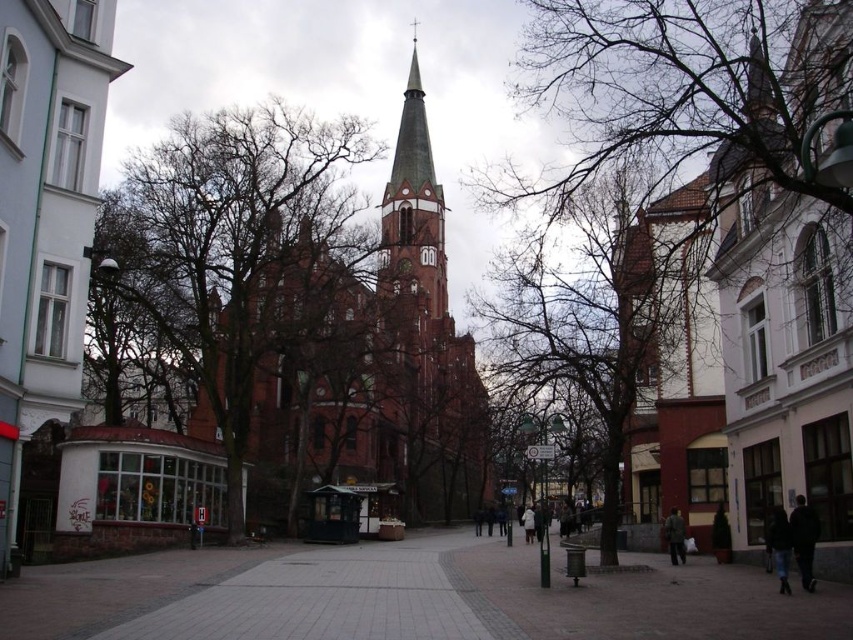
Measure the distance between bare branches at center and camera.

39.82 meters

Does point (834, 465) lie in front of point (80, 284)?

That is True.

Is point (643, 19) more distant than point (28, 92)?

Yes, it is behind point (28, 92).

Locate an element on the screen. Image resolution: width=853 pixels, height=640 pixels. bare branches at center is located at coordinates tap(734, 202).

Which is more to the right, bare branches at left or white wool coat at center?

From the viewer's perspective, white wool coat at center appears more on the right side.

Does bare branches at left have a smaller size compared to white wool coat at center?

No, bare branches at left is not smaller than white wool coat at center.

What do you see at coordinates (239, 248) in the screenshot? The width and height of the screenshot is (853, 640). I see `bare branches at left` at bounding box center [239, 248].

At what (x,y) coordinates should I click in order to perform the action: click on bare branches at left. Please return your answer as a coordinate pair (x, y). Looking at the image, I should click on (239, 248).

Can you confirm if matte brick church at center is shorter than dark green fabric jacket at center?

In fact, matte brick church at center may be taller than dark green fabric jacket at center.

Does matte brick church at center have a smaller size compared to dark green fabric jacket at center?

Actually, matte brick church at center might be larger than dark green fabric jacket at center.

Image resolution: width=853 pixels, height=640 pixels. I want to click on matte brick church at center, so click(45, 216).